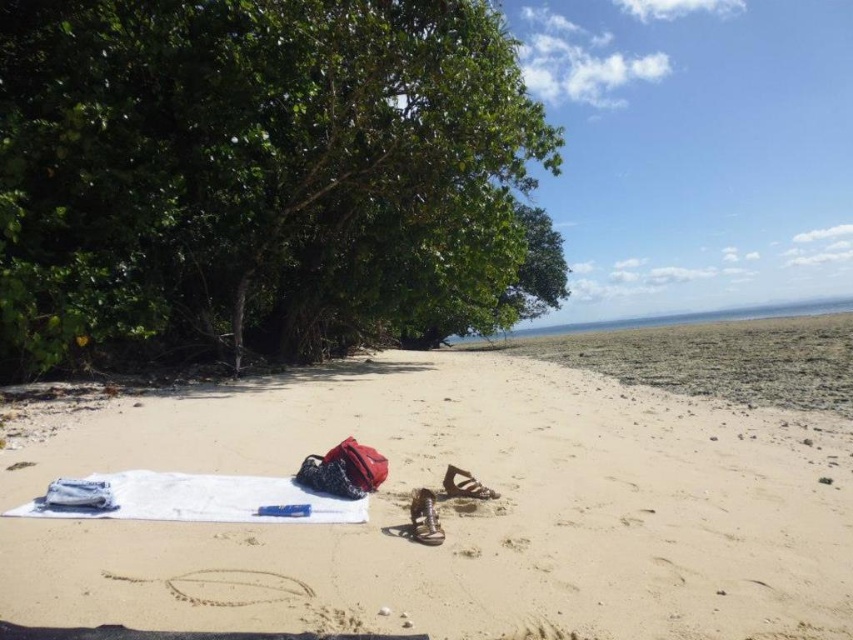
In the scene shown: You are standing on the beach and want to place a new beach umbrella between the white sand at center and the green leafy tree at left. Based on their positions, which object should the umbrella be closer to?

The white sand at center is positioned on the right side of green leafy tree at left, so the umbrella should be placed closer to the green leafy tree at left to be between them.

You are setting up a picnic area on the beach and have a white cotton towel at lower left. You want to ensure it stays in place. Considering the green leafy tree at left, which object is larger and could potentially block wind from moving the towel?

The green leafy tree at left is bigger than the white cotton towel at lower left, so it could block wind and help keep the towel in place.

You are standing at the center of the beach scene. Which direction should you walk to reach the green leafy tree at left?

You should walk to the left to reach the green leafy tree at left since it is located at the left side of the scene.